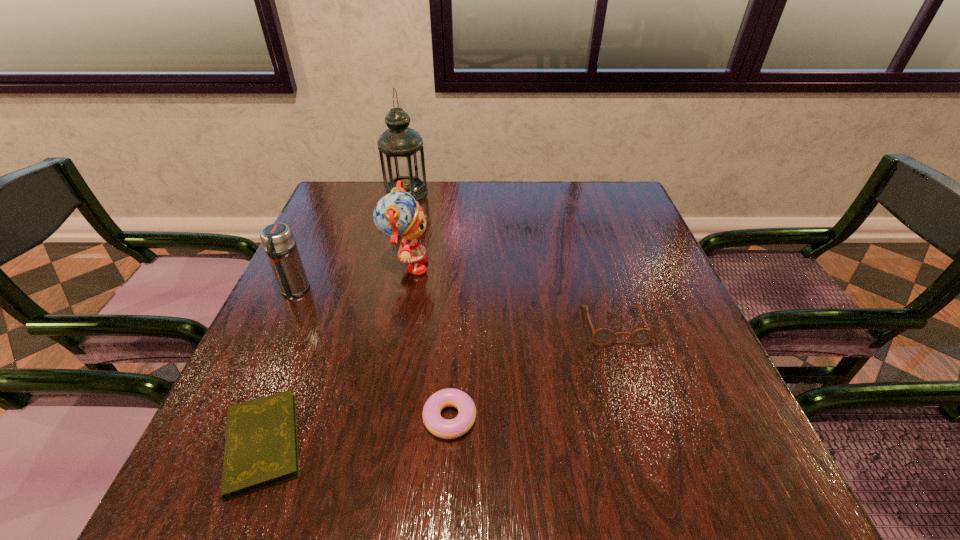
In order to click on free space in the image that satisfies the following two spatial constraints: 1. with a handle on the side of the diary; 2. on the right side of the fourth shortest object in this screenshot , I will do `click(224, 443)`.

Locate an element on the screen. The image size is (960, 540). vacant region that satisfies the following two spatial constraints: 1. on the back side of the diary; 2. on the left side of the tallest object is located at coordinates (362, 193).

Where is `free location that satisfies the following two spatial constraints: 1. with a handle on the side of the fifth tallest object; 2. on the left side of the thermos bottle`? This screenshot has height=540, width=960. free location that satisfies the following two spatial constraints: 1. with a handle on the side of the fifth tallest object; 2. on the left side of the thermos bottle is located at coordinates (235, 418).

Where is `vacant space that satisfies the following two spatial constraints: 1. with a handle on the side of the third tallest object; 2. on the left side of the diary`? vacant space that satisfies the following two spatial constraints: 1. with a handle on the side of the third tallest object; 2. on the left side of the diary is located at coordinates (224, 443).